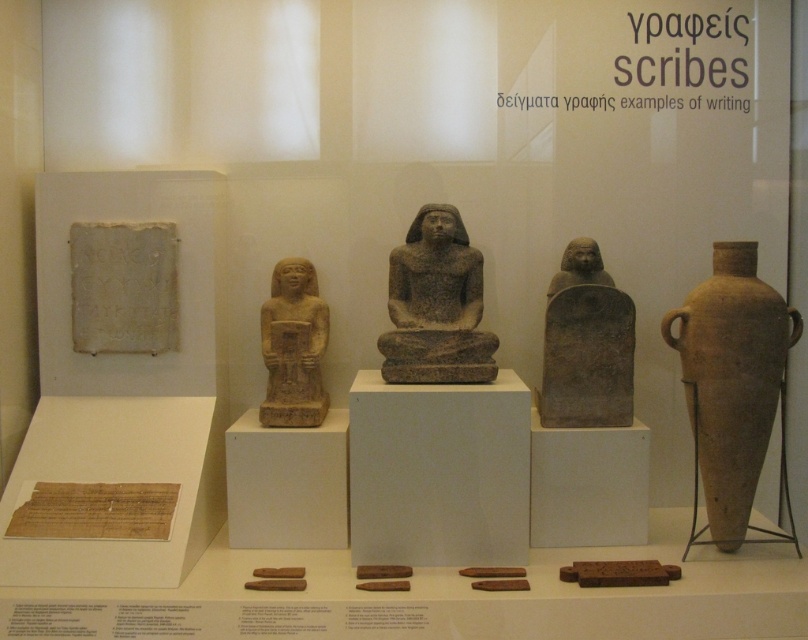
Question: Which is nearer to the brown matte vase at right?

Choices:
 (A) gray stone statue at center
 (B) gray stone stele at center

Answer: (B)

Question: Observing the image, what is the correct spatial positioning of brown matte vase at right in reference to gray stone statue at center?

Choices:
 (A) below
 (B) above

Answer: (A)

Question: Can you confirm if gray stone statue at center is thinner than beige stone statue at center?

Choices:
 (A) no
 (B) yes

Answer: (A)

Question: Which point is closer to the camera?

Choices:
 (A) (312, 358)
 (B) (684, 320)
 (C) (625, 397)
 (D) (421, 301)

Answer: (B)

Question: Based on their relative distances, which object is nearer to the beige stone statue at center?

Choices:
 (A) gray stone stele at center
 (B) brown matte vase at right

Answer: (A)

Question: Does brown matte vase at right appear on the left side of beige stone statue at center?

Choices:
 (A) yes
 (B) no

Answer: (B)